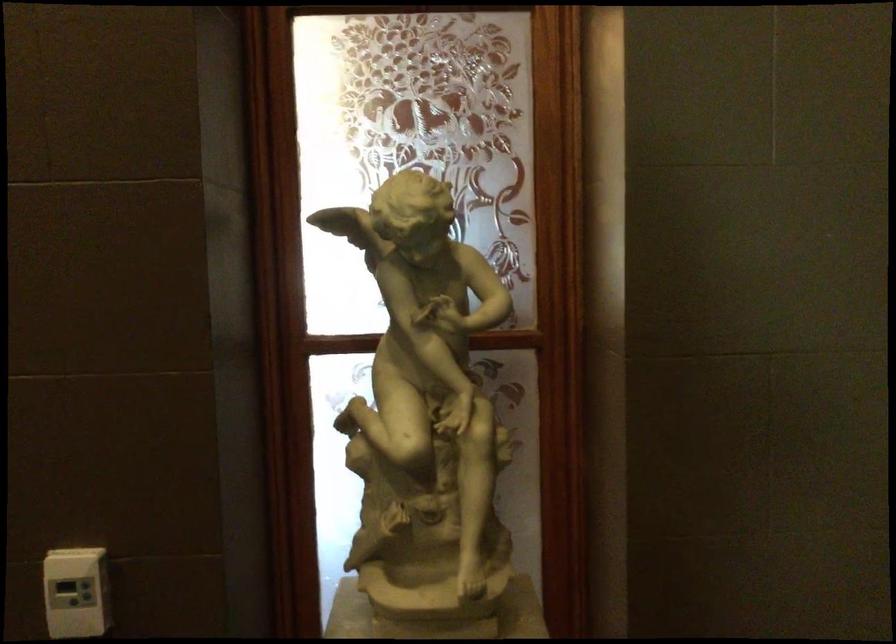
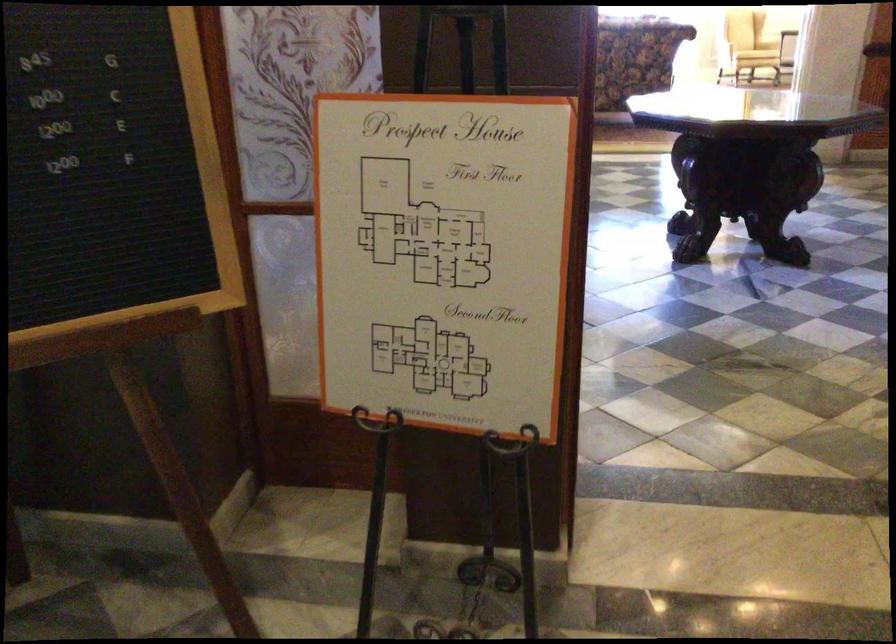
Question: In a continuous first-person perspective shot, in which direction is the camera moving?

Choices:
 (A) Left
 (B) Right
 (C) Forward
 (D) Backward

Answer: (A)